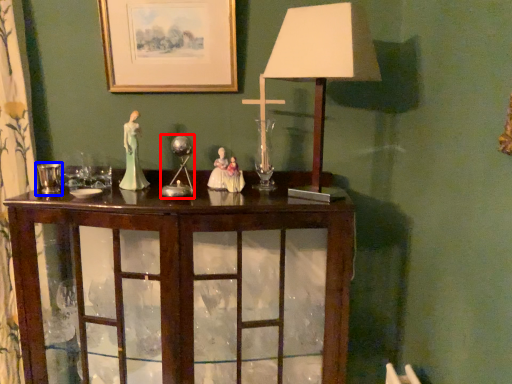
Question: Among these objects, which one is farthest to the camera, candle holder (highlighted by a red box) or candle holder (highlighted by a blue box)?

Choices:
 (A) candle holder
 (B) candle holder

Answer: (A)